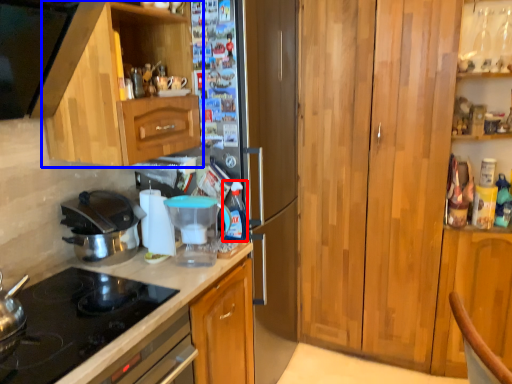
Question: Which of the following is the closest to the observer, bottle (highlighted by a red box) or cabinetry (highlighted by a blue box)?

Choices:
 (A) bottle
 (B) cabinetry

Answer: (B)